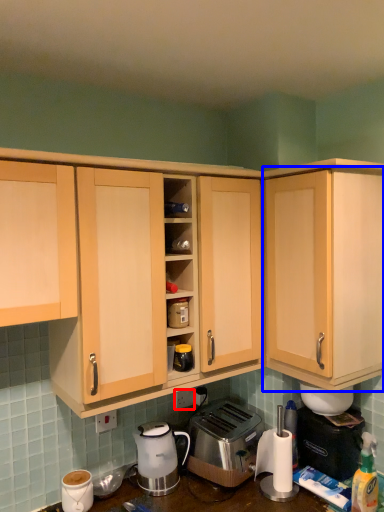
Question: Which of the following is the farthest to the observer, electric outlet (highlighted by a red box) or cabinetry (highlighted by a blue box)?

Choices:
 (A) electric outlet
 (B) cabinetry

Answer: (A)